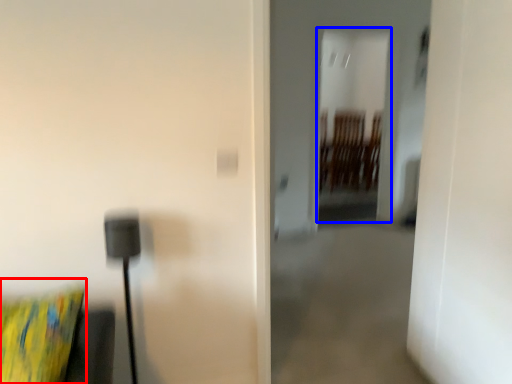
Question: Which of the following is the farthest to the observer, pillow (highlighted by a red box) or glass door (highlighted by a blue box)?

Choices:
 (A) pillow
 (B) glass door

Answer: (B)